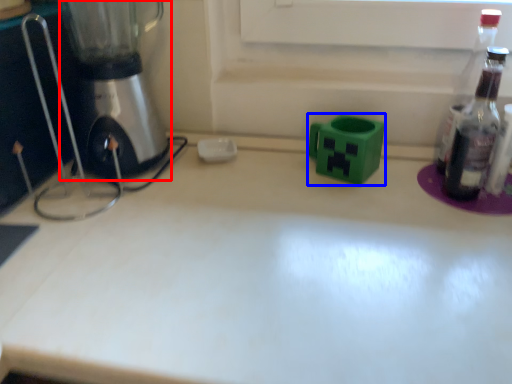
Question: Which object appears closest to the camera in this image, mixer (highlighted by a red box) or appliance (highlighted by a blue box)?

Choices:
 (A) mixer
 (B) appliance

Answer: (A)